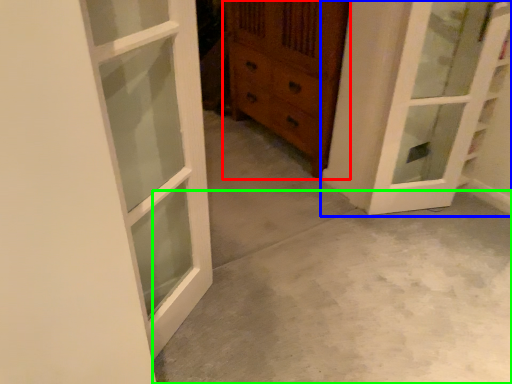
Question: Which is nearer to the chest of drawers (highlighted by a red box)? door (highlighted by a blue box) or concrete (highlighted by a green box).

Choices:
 (A) door
 (B) concrete

Answer: (A)